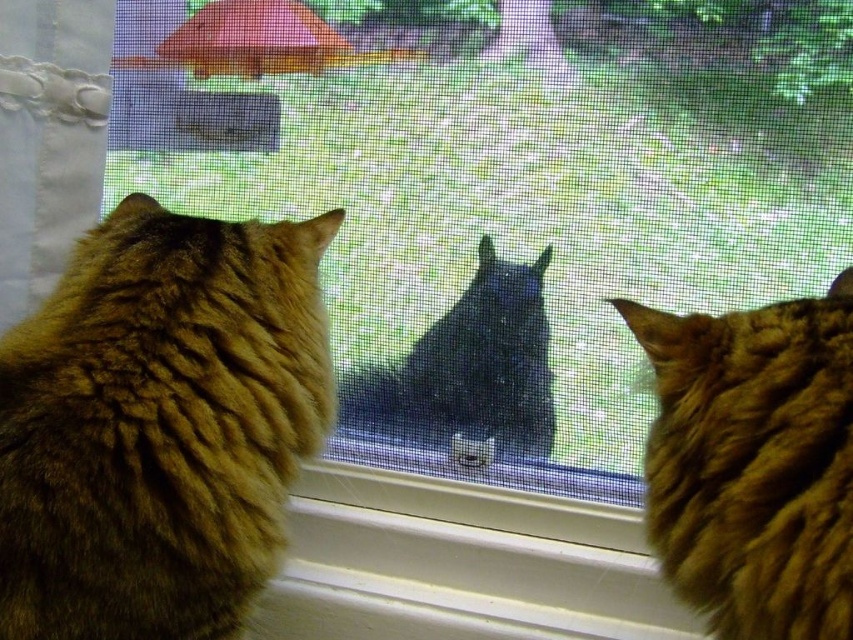
How much distance is there between white lace curtain at left and black fur cat at center?

white lace curtain at left is 20.33 inches from black fur cat at center.

Is point (70, 49) closer to camera compared to point (410, 353)?

Yes, it is.

Between point (44, 250) and point (421, 392), which one is positioned behind?

The point (421, 392) is more distant.

At what (x,y) coordinates should I click in order to perform the action: click on white lace curtain at left. Please return your answer as a coordinate pair (x, y). Looking at the image, I should click on (49, 138).

Is point (648, 308) closer to camera compared to point (106, 132)?

Yes.

Where is `fuzzy brown cat at right`? The image size is (853, 640). fuzzy brown cat at right is located at coordinates (753, 461).

Does point (720, 579) come farther from viewer compared to point (3, 84)?

No.

In order to click on fuzzy brown cat at right in this screenshot , I will do `click(753, 461)`.

Which is in front, point (4, 556) or point (492, 330)?

Positioned in front is point (4, 556).

Between fuzzy brown cat at left and black fur cat at center, which one is positioned lower?

Positioned lower is black fur cat at center.

Which is behind, point (219, 234) or point (479, 380)?

The point (479, 380) is more distant.

Where is `fuzzy brown cat at left`? The width and height of the screenshot is (853, 640). fuzzy brown cat at left is located at coordinates pos(160,424).